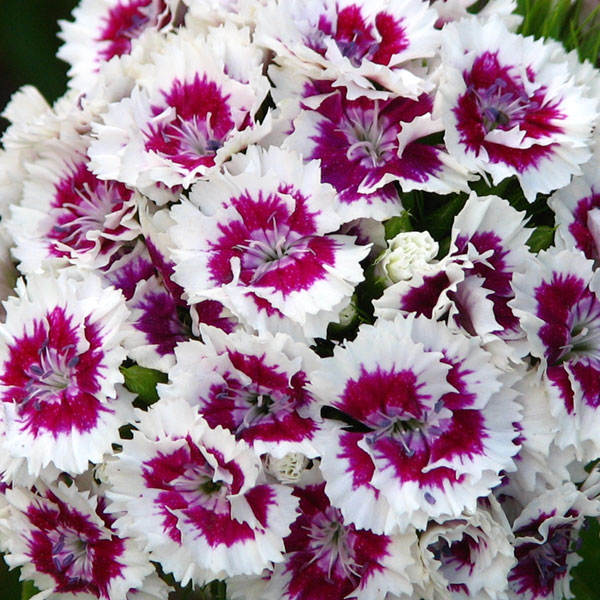
This screenshot has width=600, height=600. In order to click on white pedastals in this screenshot , I will do `click(400, 501)`.